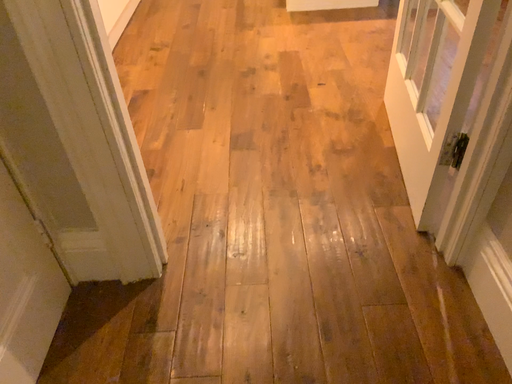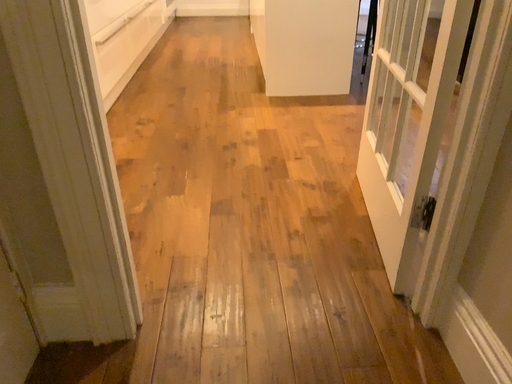
Question: How did the camera likely rotate when shooting the video?

Choices:
 (A) rotated downward
 (B) rotated upward

Answer: (B)